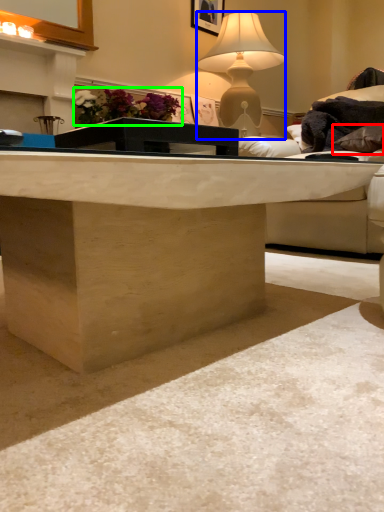
Question: Estimate the real-world distances between objects in this image. Which object is farther from pillow (highlighted by a red box), lamp (highlighted by a blue box) or flower (highlighted by a green box)?

Choices:
 (A) lamp
 (B) flower

Answer: (B)